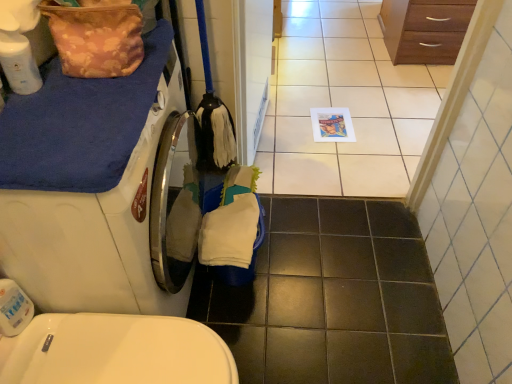
This screenshot has height=384, width=512. Describe the element at coordinates (96, 39) in the screenshot. I see `floral fabric bag at upper left` at that location.

Image resolution: width=512 pixels, height=384 pixels. I want to click on floral fabric bag at upper left, so click(x=96, y=39).

Where is `wooden chest of drawers at upper right`? wooden chest of drawers at upper right is located at coordinates (424, 29).

This screenshot has height=384, width=512. Identify the location of white matte washing machine at left. (88, 186).

Locate an element on the screen. The height and width of the screenshot is (384, 512). white glossy screen door at center is located at coordinates (254, 73).

What do you see at coordinates (344, 105) in the screenshot?
I see `white glossy tile at center` at bounding box center [344, 105].

At what (x,y) coordinates should I click in order to perform the action: click on floral fabric bag at upper left. Please return your answer as a coordinate pair (x, y). This screenshot has width=512, height=384. Looking at the image, I should click on (96, 39).

Is there a large distance between white glossy tile at center and white glossy screen door at center?

No, there isn't a large distance between white glossy tile at center and white glossy screen door at center.

Is white glossy tile at center oriented away from white glossy screen door at center?

No, white glossy screen door at center is not at the back of white glossy tile at center.

Is white glossy tile at center located outside white glossy screen door at center?

Yes, white glossy tile at center is not within white glossy screen door at center.

Is floral fabric bag at upper left oriented towards white matte washing machine at left?

No, floral fabric bag at upper left is not aimed at white matte washing machine at left.

Considering the relative positions of floral fabric bag at upper left and white matte washing machine at left in the image provided, is floral fabric bag at upper left to the left or to the right of white matte washing machine at left?

floral fabric bag at upper left is positioned on white matte washing machine at left's right side.

Which is less distant, (101, 23) or (113, 185)?

The point (113, 185) is closer to the camera.

From a real-world perspective, is floral fabric bag at upper left below white matte washing machine at left?

No.

Are white glossy tile at center and wooden chest of drawers at upper right located far from each other?

white glossy tile at center is near wooden chest of drawers at upper right, not far away.

Consider the image. Is the depth of white glossy tile at center less than that of wooden chest of drawers at upper right?

Yes, white glossy tile at center is closer to the camera.

At what (x,y) coordinates should I click in order to perform the action: click on tile lying below the wooden chest of drawers at upper right (from the image's perspective). Please return your answer as a coordinate pair (x, y). This screenshot has width=512, height=384. Looking at the image, I should click on (344, 105).

From a real-world perspective, which object stands above the other?

In real-world perspective, wooden chest of drawers at upper right is above.

Can you confirm if white matte washing machine at left is positioned to the left of wooden chest of drawers at upper right?

Yes, white matte washing machine at left is to the left of wooden chest of drawers at upper right.

Considering the relative sizes of white matte washing machine at left and wooden chest of drawers at upper right in the image provided, is white matte washing machine at left smaller than wooden chest of drawers at upper right?

No.

How many degrees apart are the facing directions of white matte washing machine at left and wooden chest of drawers at upper right?

white matte washing machine at left and wooden chest of drawers at upper right are facing 87 degrees away from each other.

From the picture: Is white matte washing machine at left far away from wooden chest of drawers at upper right?

That's right, there is a large distance between white matte washing machine at left and wooden chest of drawers at upper right.

Is wooden chest of drawers at upper right further to the viewer compared to white matte washing machine at left?

Yes, wooden chest of drawers at upper right is further from the viewer.

Considering the sizes of wooden chest of drawers at upper right and white matte washing machine at left in the image, is wooden chest of drawers at upper right wider or thinner than white matte washing machine at left?

Clearly, wooden chest of drawers at upper right has less width compared to white matte washing machine at left.

Between wooden chest of drawers at upper right and white matte washing machine at left, which one has larger size?

Bigger between the two is white matte washing machine at left.

Is the surface of wooden chest of drawers at upper right in direct contact with white matte washing machine at left?

wooden chest of drawers at upper right is not next to white matte washing machine at left, and they're not touching.

From a real-world perspective, is white glossy screen door at center located higher than floral fabric bag at upper left?

No, from a real-world perspective, white glossy screen door at center is not over floral fabric bag at upper left

Is white glossy screen door at center at the right side of floral fabric bag at upper left?

Yes.

In the scene shown: Is white glossy screen door at center placed right next to floral fabric bag at upper left?

white glossy screen door at center and floral fabric bag at upper left are not in contact.

Looking at this image, is white glossy screen door at center oriented towards floral fabric bag at upper left?

No, white glossy screen door at center is not turned towards floral fabric bag at upper left.

At what (x,y) coordinates should I click in order to perform the action: click on material above the white matte washing machine at left (from a real-world perspective). Please return your answer as a coordinate pair (x, y). Image resolution: width=512 pixels, height=384 pixels. Looking at the image, I should click on (96, 39).

Considering the positions of objects white matte washing machine at left and floral fabric bag at upper left in the image provided, who is more to the left, white matte washing machine at left or floral fabric bag at upper left?

white matte washing machine at left.

From a real-world perspective, is white matte washing machine at left on floral fabric bag at upper left?

No.

Is white matte washing machine at left thinner than floral fabric bag at upper left?

In fact, white matte washing machine at left might be wider than floral fabric bag at upper left.

Image resolution: width=512 pixels, height=384 pixels. Find the location of `screen door that appears below the white glossy tile at center (from the image's perspective)`. screen door that appears below the white glossy tile at center (from the image's perspective) is located at coordinates (254, 73).

Image resolution: width=512 pixels, height=384 pixels. In order to click on material that is on the right side of white matte washing machine at left in this screenshot , I will do `click(96, 39)`.

Based on their spatial positions, is white matte washing machine at left or white glossy screen door at center further from wooden chest of drawers at upper right?

Based on the image, white matte washing machine at left appears to be further to wooden chest of drawers at upper right.

Estimate the real-world distances between objects in this image. Which object is further from wooden chest of drawers at upper right, floral fabric bag at upper left or white matte washing machine at left?

Among the two, white matte washing machine at left is located further to wooden chest of drawers at upper right.

Looking at the image, which one is located closer to white matte washing machine at left, floral fabric bag at upper left or white glossy screen door at center?

The object closer to white matte washing machine at left is floral fabric bag at upper left.

Which object lies further to the anchor point white glossy tile at center, floral fabric bag at upper left or wooden chest of drawers at upper right?

floral fabric bag at upper left is further to white glossy tile at center.

From the image, which object appears to be farther from white matte washing machine at left, wooden chest of drawers at upper right or floral fabric bag at upper left?

Based on the image, wooden chest of drawers at upper right appears to be further to white matte washing machine at left.

Which object lies further to the anchor point white matte washing machine at left, floral fabric bag at upper left or white glossy tile at center?

white glossy tile at center is further to white matte washing machine at left.

When comparing their distances from white glossy screen door at center, does floral fabric bag at upper left or white glossy tile at center seem further?

Based on the image, floral fabric bag at upper left appears to be further to white glossy screen door at center.

Estimate the real-world distances between objects in this image. Which object is closer to white matte washing machine at left, wooden chest of drawers at upper right or white glossy tile at center?

white glossy tile at center lies closer to white matte washing machine at left than the other object.

Locate an element on the screen. This screenshot has height=384, width=512. tile situated between white glossy screen door at center and wooden chest of drawers at upper right from left to right is located at coordinates [344, 105].

In order to click on screen door located between white matte washing machine at left and wooden chest of drawers at upper right in the depth direction in this screenshot , I will do `click(254, 73)`.

Where is `material between white matte washing machine at left and wooden chest of drawers at upper right from front to back`? The image size is (512, 384). material between white matte washing machine at left and wooden chest of drawers at upper right from front to back is located at coordinates (96, 39).

Find the location of a particular element. screen door between white matte washing machine at left and white glossy tile at center in the front-back direction is located at coordinates (254, 73).